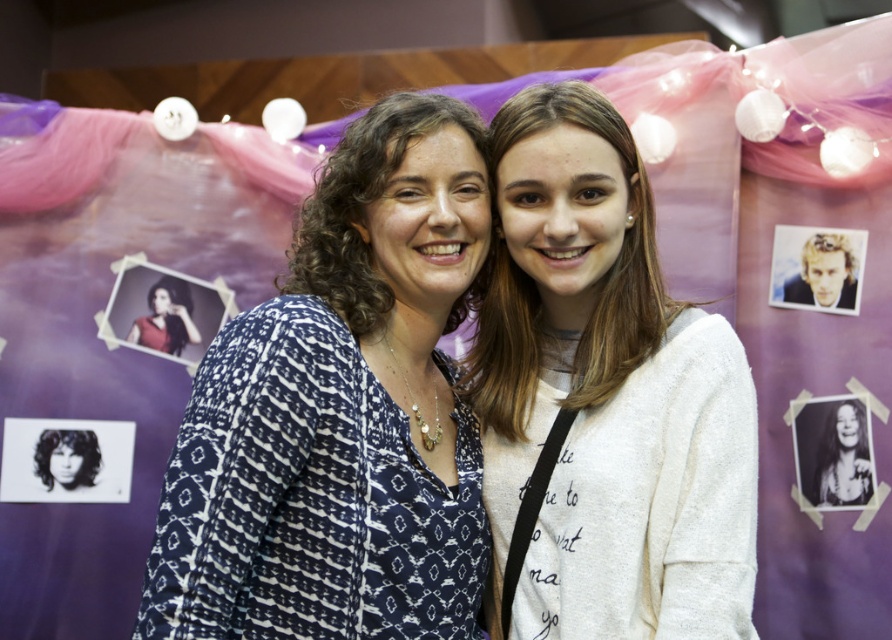
Can you confirm if white soft sweater at center is taller than matte red blouse at center?

Correct, white soft sweater at center is much taller as matte red blouse at center.

Is white soft sweater at center positioned at the back of matte red blouse at center?

No, it is in front of matte red blouse at center.

Which is behind, point (549, 480) or point (164, 285)?

Point (164, 285)

The width and height of the screenshot is (892, 640). I want to click on white soft sweater at center, so click(604, 397).

Which is more to the left, white soft sweater at center or black glossy photo at center?

Positioned to the left is white soft sweater at center.

In the scene shown: Does white soft sweater at center have a greater width compared to black glossy photo at center?

Yes.

Does point (634, 419) come closer to viewer compared to point (828, 432)?

Yes.

What are the coordinates of `white soft sweater at center` in the screenshot? It's located at (604, 397).

Between point (840, 465) and point (155, 330), which one is positioned in front?

Point (840, 465)

Who is more distant from viewer, [833,444] or [178,326]?

Point [178,326]

Locate an element on the screen. black glossy photo at center is located at coordinates pos(841,458).